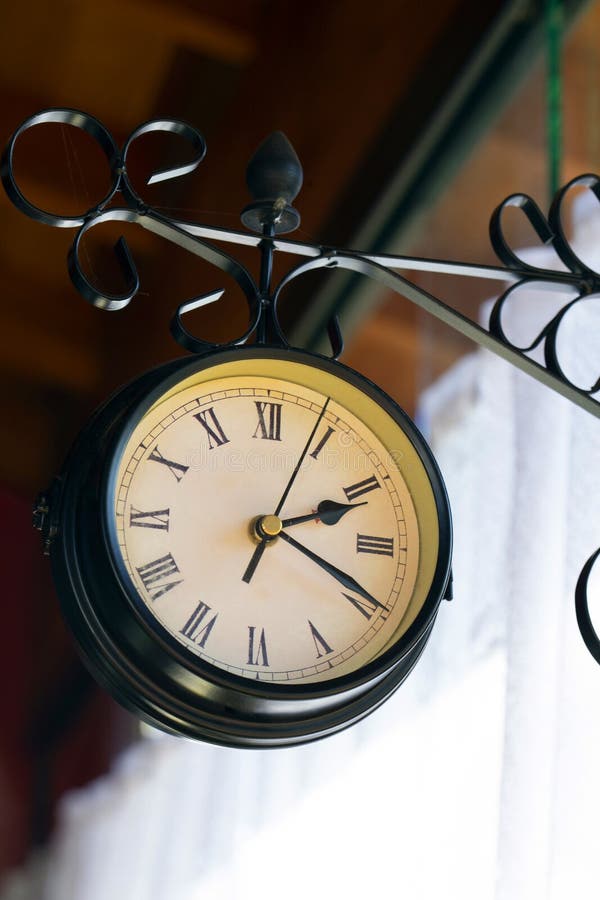
Locate an element on the screen. Image resolution: width=600 pixels, height=900 pixels. black rim around clock is located at coordinates (446, 549).